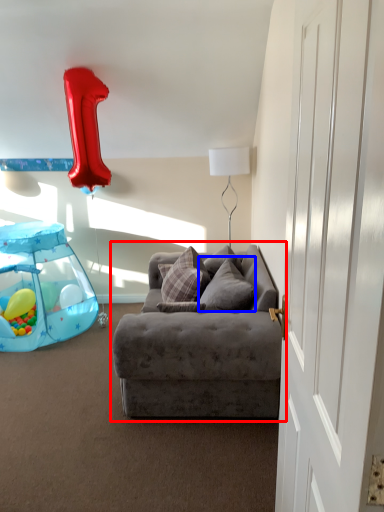
Question: Among these objects, which one is farthest to the camera, studio couch (highlighted by a red box) or pillow (highlighted by a blue box)?

Choices:
 (A) studio couch
 (B) pillow

Answer: (B)